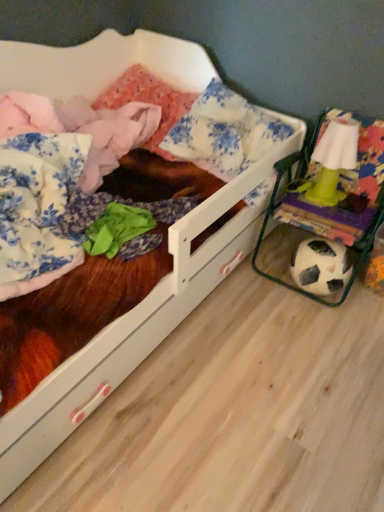
Question: Does green plastic lamp at right turn towards white wooden bed at center?

Choices:
 (A) yes
 (B) no

Answer: (B)

Question: Is green plastic lamp at right bigger than white wooden bed at center?

Choices:
 (A) no
 (B) yes

Answer: (A)

Question: Is green plastic lamp at right smaller than white wooden bed at center?

Choices:
 (A) yes
 (B) no

Answer: (A)

Question: Is white wooden bed at center at the back of green plastic lamp at right?

Choices:
 (A) no
 (B) yes

Answer: (A)

Question: Considering the relative sizes of green plastic lamp at right and white wooden bed at center in the image provided, is green plastic lamp at right wider than white wooden bed at center?

Choices:
 (A) no
 (B) yes

Answer: (A)

Question: From a real-world perspective, is green plastic lamp at right under white wooden bed at center?

Choices:
 (A) no
 (B) yes

Answer: (A)

Question: Can you confirm if white wooden bed at center is shorter than green plastic lamp at right?

Choices:
 (A) yes
 (B) no

Answer: (B)

Question: Is white wooden bed at center positioned with its back to green plastic lamp at right?

Choices:
 (A) yes
 (B) no

Answer: (B)

Question: Is white wooden bed at center to the right of green plastic lamp at right from the viewer's perspective?

Choices:
 (A) yes
 (B) no

Answer: (B)

Question: From the image's perspective, is white wooden bed at center beneath green plastic lamp at right?

Choices:
 (A) yes
 (B) no

Answer: (A)

Question: Can you confirm if white wooden bed at center is positioned to the left of green plastic lamp at right?

Choices:
 (A) no
 (B) yes

Answer: (B)

Question: From the image's perspective, is white wooden bed at center on green plastic lamp at right?

Choices:
 (A) yes
 (B) no

Answer: (B)

Question: From a real-world perspective, relative to green plastic lamp at right, is white wooden bed at center vertically above or below?

Choices:
 (A) below
 (B) above

Answer: (A)